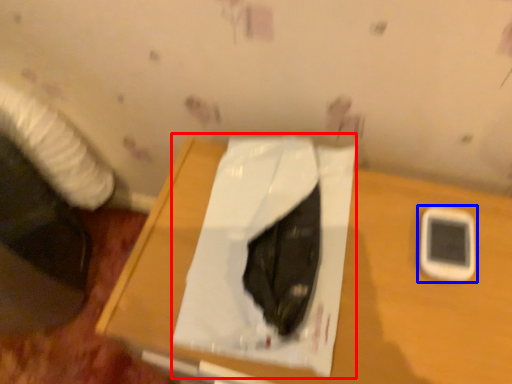
Question: Which of the following is the closest to the observer, sheet (highlighted by a red box) or mobile phone (highlighted by a blue box)?

Choices:
 (A) sheet
 (B) mobile phone

Answer: (A)